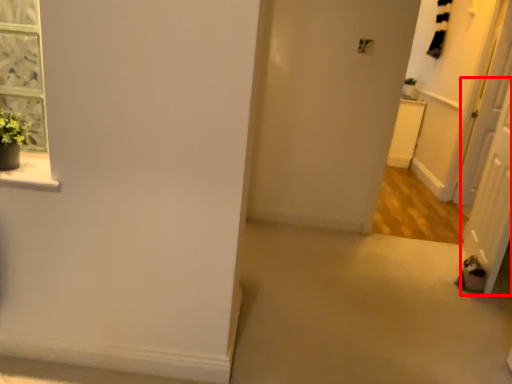
Question: Observing the image, what is the correct spatial positioning of screen door (annotated by the red box) in reference to screen door?

Choices:
 (A) right
 (B) left

Answer: (B)